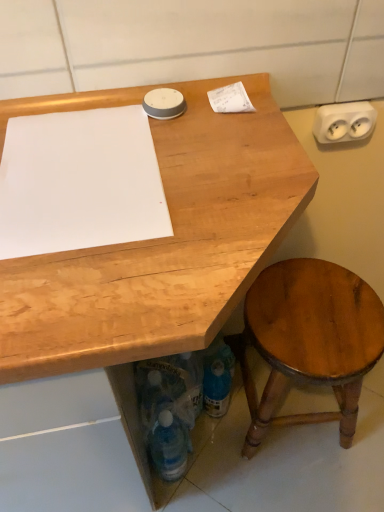
Question: Considering the positions of white paper at upper right, the first notepad in the right-to-left sequence, and white paper at upper left, arranged as the first notepad when ordered from the bottom, in the image, is white paper at upper right, the first notepad in the right-to-left sequence, taller or shorter than white paper at upper left, arranged as the first notepad when ordered from the bottom,?

Choices:
 (A) tall
 (B) short

Answer: (A)

Question: From a real-world perspective, is white paper at upper right, positioned as the 2th notepad in left-to-right order, above or below white paper at upper left, which is the 1th notepad in left-to-right order?

Choices:
 (A) below
 (B) above

Answer: (B)

Question: Estimate the real-world distances between objects in this image. Which object is closer to the translucent plastic bottle at lower center, arranged as the first bottle when viewed from the right?

Choices:
 (A) white paper at upper left, arranged as the first notepad when ordered from the bottom
 (B) translucent plastic bottle at lower center, the 2th bottle positioned from the right
 (C) wooden desk at center
 (D) white paper at upper right, the first notepad in the right-to-left sequence
 (E) white plastic electrical outlet at upper right

Answer: (B)

Question: Which object is the closest to the translucent plastic bottle at lower center, the 2th bottle positioned from the right?

Choices:
 (A) white plastic electrical outlet at upper right
 (B) translucent plastic bottle at lower center, which ranks as the 2th bottle in left-to-right order
 (C) shiny brown wood stool at lower right
 (D) white paper at upper right, positioned as the 2th notepad in left-to-right order
 (E) wooden desk at center

Answer: (B)